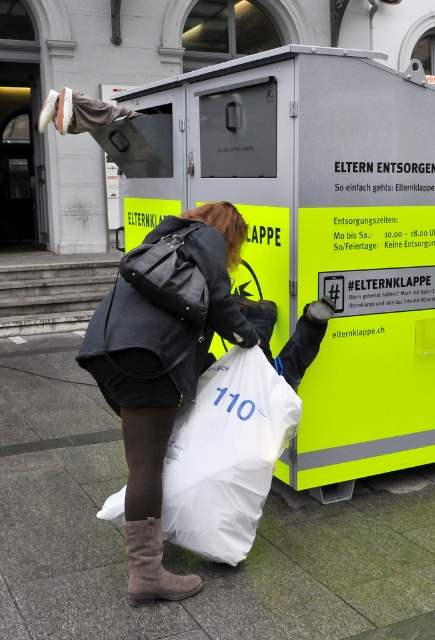
Can you confirm if smooth concrete pavement at lower center is positioned to the left of white plastic bag at lower center?

Indeed, smooth concrete pavement at lower center is positioned on the left side of white plastic bag at lower center.

Looking at this image, which is above, smooth concrete pavement at lower center or white plastic bag at lower center?

Positioned higher is white plastic bag at lower center.

Does point (93, 509) lie behind point (244, 360)?

Yes, it is.

You are a GUI agent. You are given a task and a screenshot of the screen. Output one action in this format:
    pyautogui.click(x=<x>, y=<y>)
    Task: Click on the smooth concrete pavement at lower center
    The width and height of the screenshot is (435, 640).
    Given the screenshot: What is the action you would take?
    pyautogui.click(x=180, y=548)

From the picture: Is the position of matte black jacket at center more distant than that of brown suede boot at lower left?

No, it is not.

Between point (126, 259) and point (166, 595), which one is positioned behind?

Positioned behind is point (166, 595).

Identify the location of matte black jacket at center. (163, 362).

Identify the location of matte black jacket at center. This screenshot has height=640, width=435. (163, 362).

Who is more forward, (120, 292) or (180, 474)?

Point (120, 292) is in front.

Who is more distant from viewer, (147, 499) or (251, 465)?

The point (251, 465) is behind.

Identify the location of matte black jacket at center. This screenshot has width=435, height=640. (163, 362).